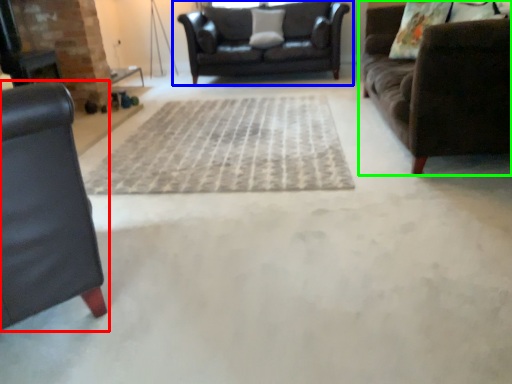
Question: Which object is the closest to the studio couch (highlighted by a red box)? Choose among these: studio couch (highlighted by a blue box) or studio couch (highlighted by a green box).

Choices:
 (A) studio couch
 (B) studio couch

Answer: (B)